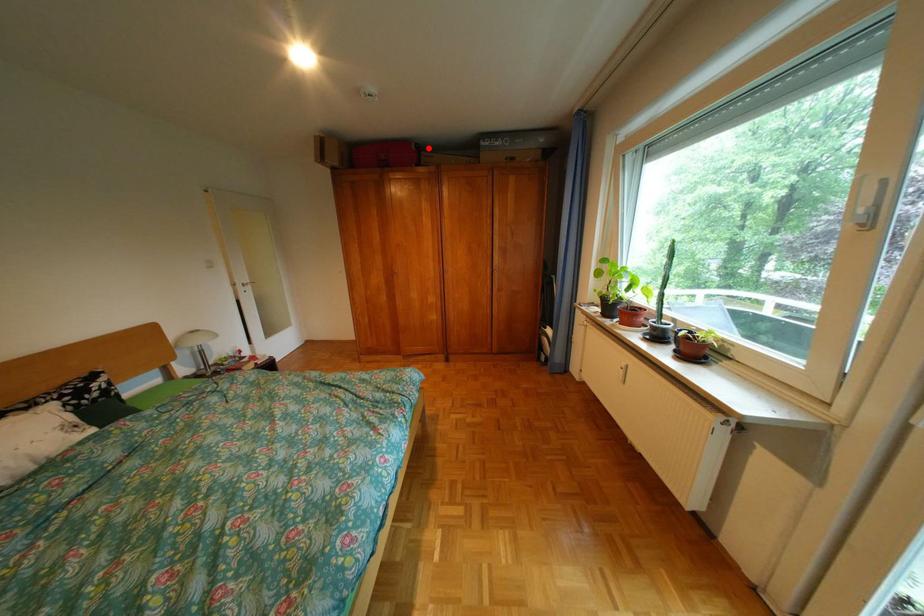
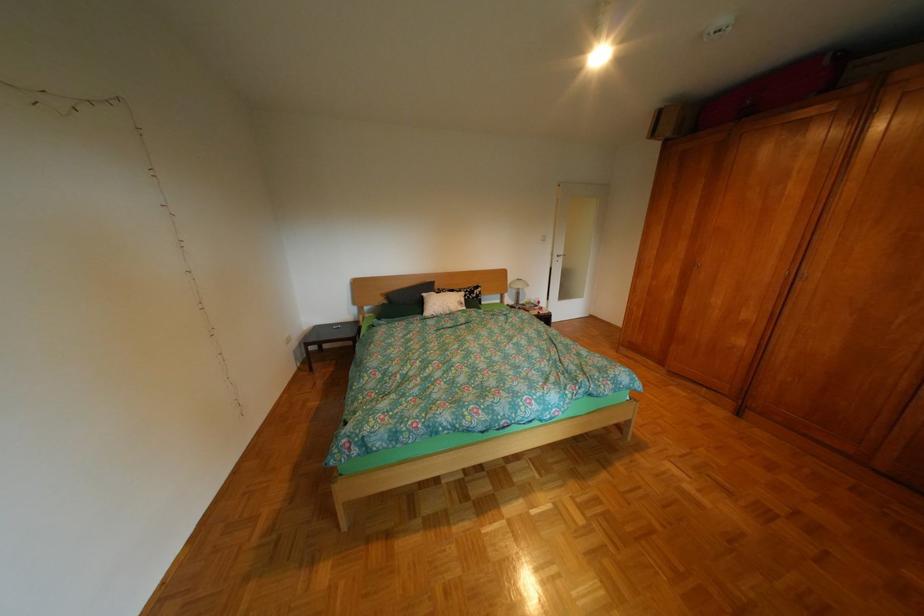
Question: I am providing you with two images of the same scene from different viewpoints. Image1 has a red point marked. In image2, the corresponding 3D location appears at what relative position? Reply with the corresponding letter.

Choices:
 (A) Closer
 (B) Farther

Answer: (B)